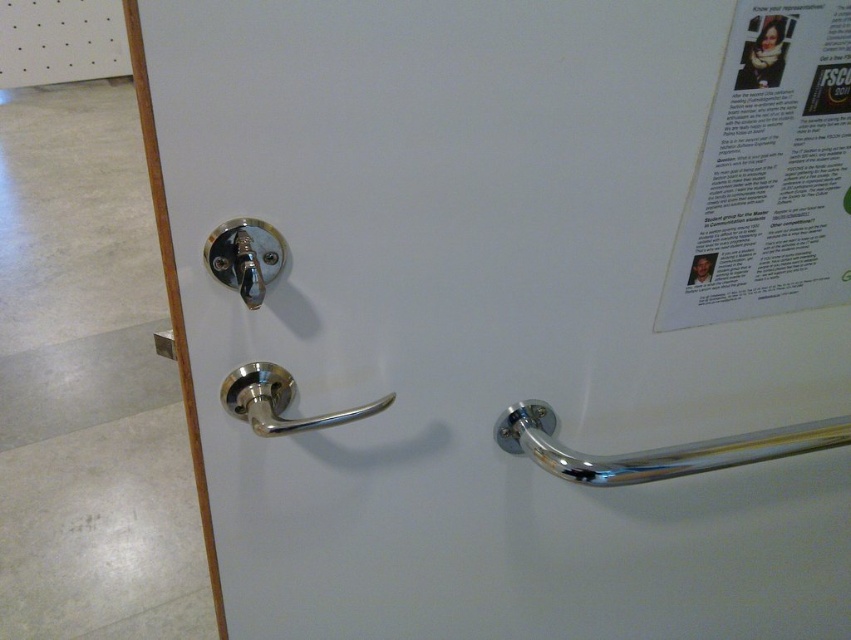
Question: Among these objects, which one is nearest to the camera?

Choices:
 (A) polished metal door handle at center-left
 (B) white paper poster at upper right
 (C) chrome/metallic handle at lower right
 (D) polished metal lock at upper left

Answer: (D)

Question: Can you confirm if polished metal door handle at center-left is positioned to the left of polished metal lock at upper left?

Choices:
 (A) yes
 (B) no

Answer: (B)

Question: Can you confirm if white paper poster at upper right is thinner than polished metal lock at upper left?

Choices:
 (A) no
 (B) yes

Answer: (A)

Question: Estimate the real-world distances between objects in this image. Which object is farther from the chrome/metallic handle at lower right?

Choices:
 (A) polished metal lock at upper left
 (B) polished metal door handle at center-left

Answer: (A)

Question: Based on their relative distances, which object is nearer to the polished metal lock at upper left?

Choices:
 (A) polished metal door handle at center-left
 (B) white paper poster at upper right
 (C) chrome/metallic handle at lower right

Answer: (A)

Question: Does white paper poster at upper right appear on the right side of chrome/metallic handle at lower right?

Choices:
 (A) no
 (B) yes

Answer: (B)